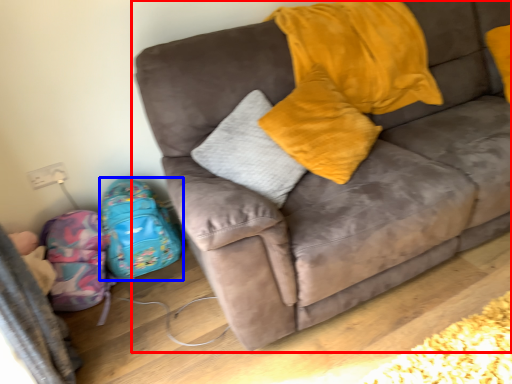
Question: Among these objects, which one is nearest to the camera, studio couch (highlighted by a red box) or luggage (highlighted by a blue box)?

Choices:
 (A) studio couch
 (B) luggage

Answer: (A)